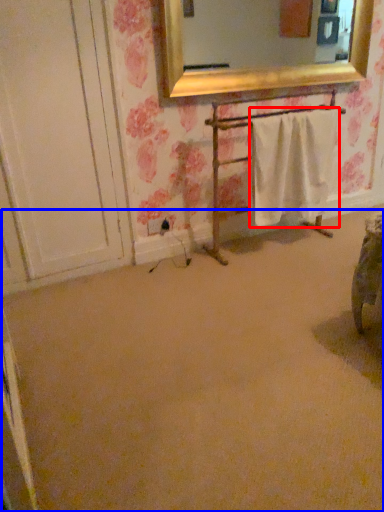
Question: Among these objects, which one is farthest to the camera, bath towel (highlighted by a red box) or plain (highlighted by a blue box)?

Choices:
 (A) bath towel
 (B) plain

Answer: (A)